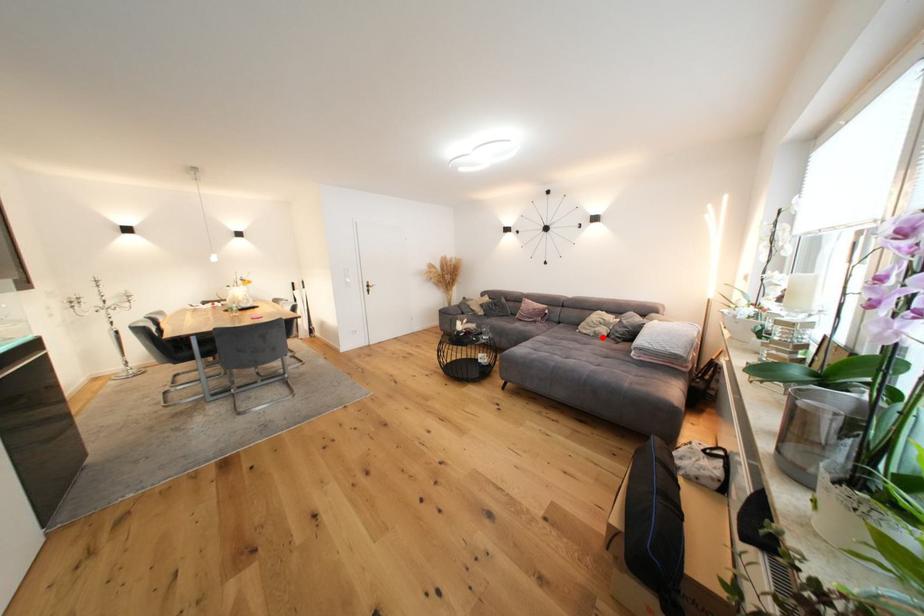
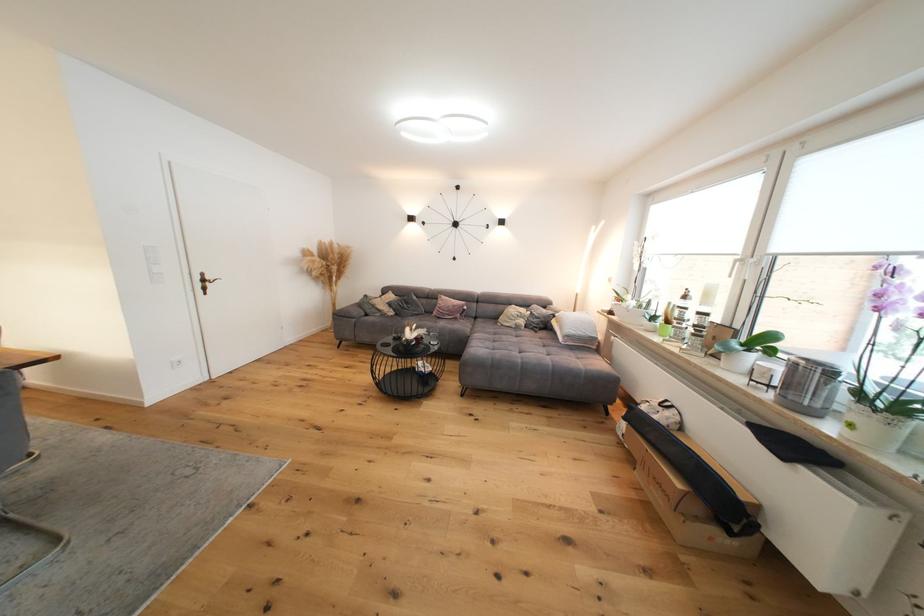
Locate, in the second image, the point that corresponds to the highlighted location in the first image.

(524, 330)